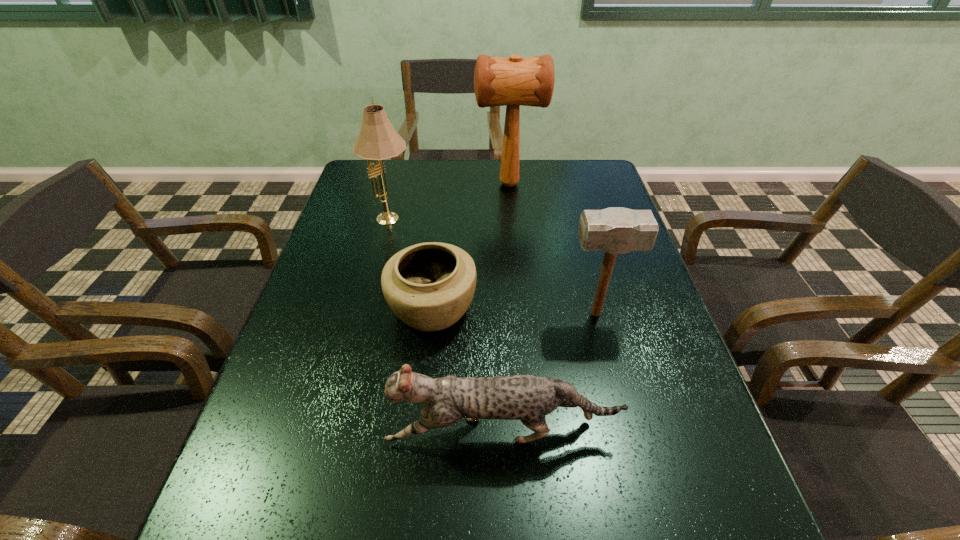
Where is `the farther mallet`? This screenshot has height=540, width=960. the farther mallet is located at coordinates (511, 82).

The height and width of the screenshot is (540, 960). In order to click on the taller mallet in this screenshot , I will do `click(511, 82)`.

The width and height of the screenshot is (960, 540). In order to click on the fourth nearest object in this screenshot , I will do `click(378, 140)`.

You are a GUI agent. You are given a task and a screenshot of the screen. Output one action in this format:
    pyautogui.click(x=<x>, y=<y>)
    Task: Click on the nearer mallet
    This screenshot has height=540, width=960.
    Given the screenshot: What is the action you would take?
    pyautogui.click(x=615, y=230)

The image size is (960, 540). I want to click on the third tallest object, so click(615, 230).

Locate an element on the screen. The height and width of the screenshot is (540, 960). the fourth tallest object is located at coordinates (529, 398).

Find the location of `cat`. cat is located at coordinates (529, 398).

You are a GUI agent. You are given a task and a screenshot of the screen. Output one action in this format:
    pyautogui.click(x=<x>, y=<y>)
    Task: Click on the shortest object
    Image resolution: width=960 pixels, height=540 pixels.
    Given the screenshot: What is the action you would take?
    pyautogui.click(x=429, y=286)

Identify the location of free space located on the strike surface of the taller mallet. click(x=420, y=184).

The width and height of the screenshot is (960, 540). Find the location of `vacant region located 0.250m on the strike surface of the taller mallet`. vacant region located 0.250m on the strike surface of the taller mallet is located at coordinates pyautogui.click(x=400, y=184).